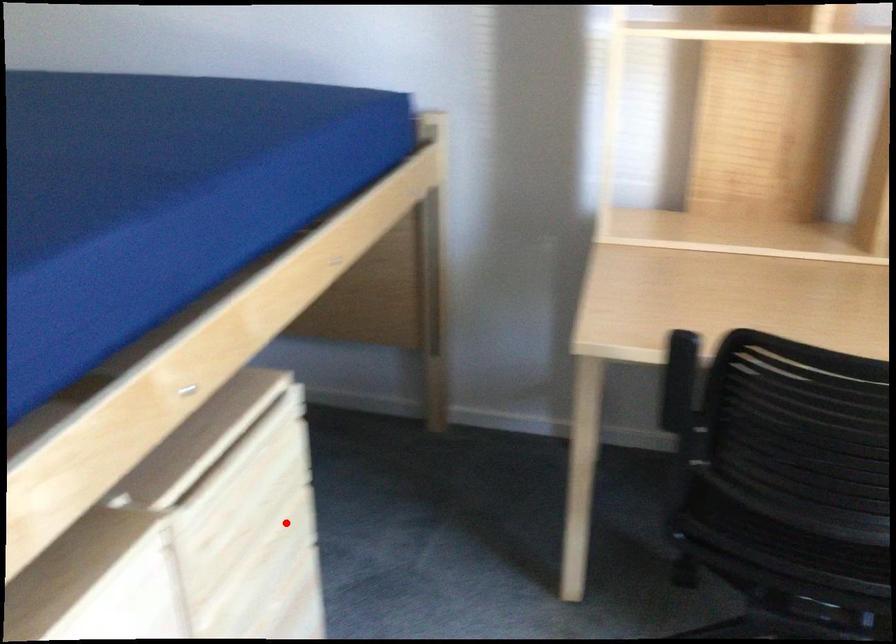
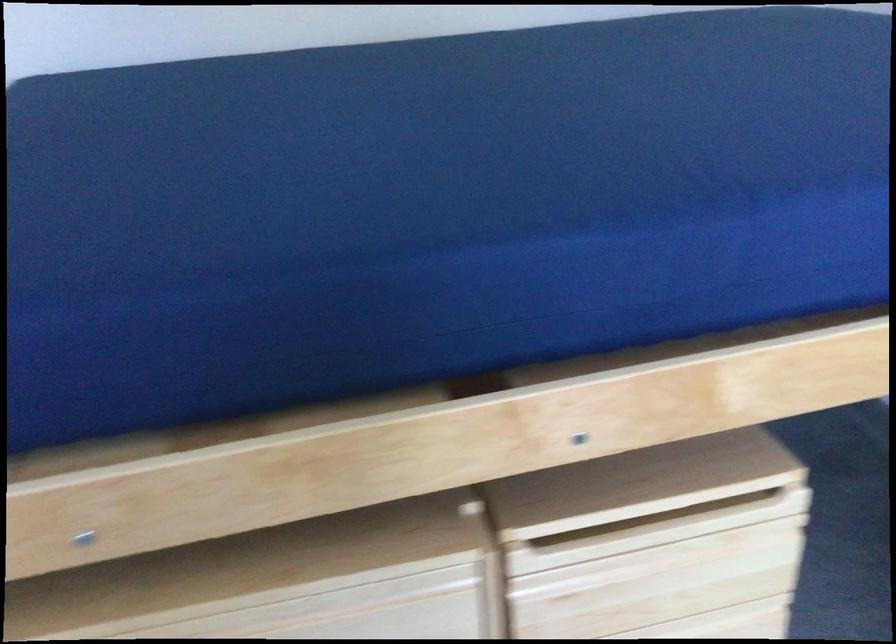
Question: I am providing you with two images of the same scene from different viewpoints. Given a red point in image1, look at the same physical point in image2. Is it:

Choices:
 (A) Closer to the viewpoint
 (B) Farther from the viewpoint

Answer: (A)